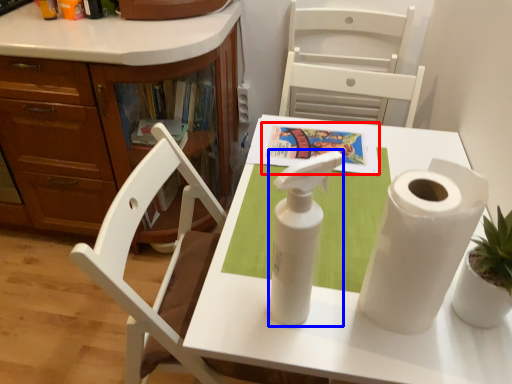
Question: Among these objects, which one is farthest to the camera, book (highlighted by a red box) or soap dispenser (highlighted by a blue box)?

Choices:
 (A) book
 (B) soap dispenser

Answer: (A)